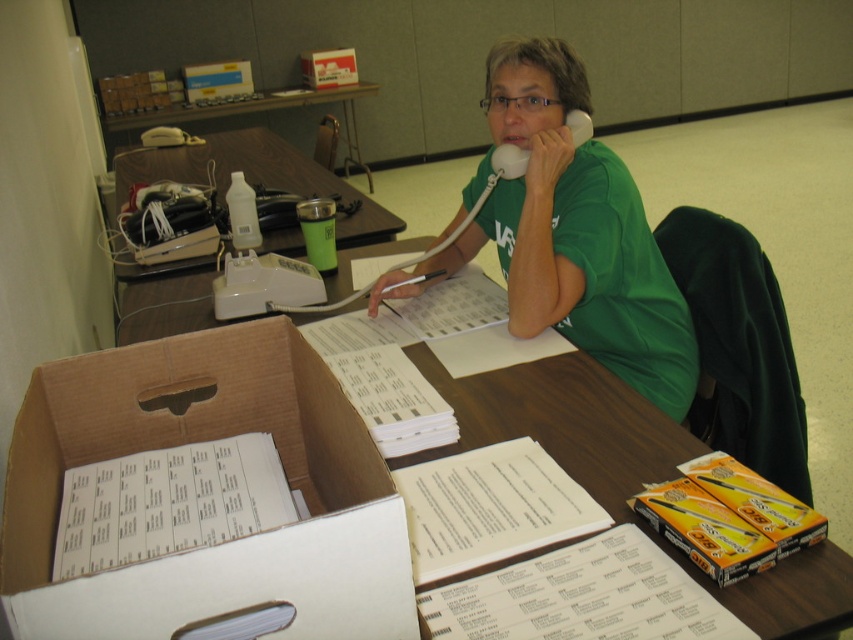
Who is taller, white paper at center or blue cardboard box at upper left?

white paper at center is taller.

Does point (624, 472) lie behind point (204, 86)?

No, it is in front of (204, 86).

Locate an element on the screen. This screenshot has width=853, height=640. white paper at center is located at coordinates (563, 420).

Locate an element on the screen. The height and width of the screenshot is (640, 853). white paper at center is located at coordinates (563, 420).

Measure the distance from wooden table at upper center to white cardboard box at upper center.

wooden table at upper center is 12.33 inches away from white cardboard box at upper center.

Between wooden table at upper center and white cardboard box at upper center, which one is positioned higher?

white cardboard box at upper center

Image resolution: width=853 pixels, height=640 pixels. What do you see at coordinates (260, 113) in the screenshot?
I see `wooden table at upper center` at bounding box center [260, 113].

Locate an element on the screen. Image resolution: width=853 pixels, height=640 pixels. wooden table at upper center is located at coordinates (260, 113).

Measure the distance between point [131,451] and camera.

A distance of 33.78 inches exists between point [131,451] and camera.

Can you confirm if white cardboard box at center is positioned above wooden table at upper center?

Actually, white cardboard box at center is below wooden table at upper center.

Does point (213, 589) lie in front of point (282, 106)?

Yes, point (213, 589) is closer to viewer.

What are the coordinates of `white cardboard box at center` in the screenshot? It's located at (198, 442).